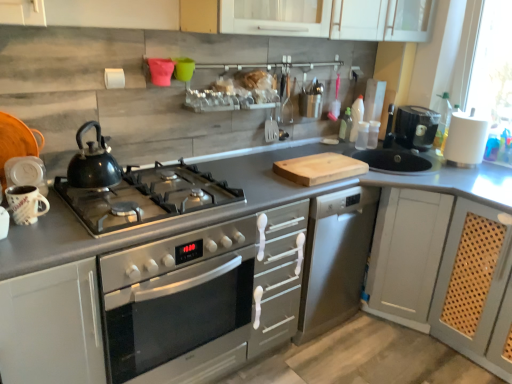
What do you see at coordinates (52, 326) in the screenshot? I see `white matte cabinet at lower left, which is the 1th cabinetry from left to right` at bounding box center [52, 326].

What is the approximate height of transparent plastic bottle at upper right?

The height of transparent plastic bottle at upper right is 8.45 inches.

What do you see at coordinates (26, 204) in the screenshot?
I see `matte ceramic mug at left, the 1th appliance from the left` at bounding box center [26, 204].

What is the approximate width of matte gray cabinet at right, the 1th cabinetry in the right-to-left sequence?

26.58 inches.

Measure the distance between point (319, 158) and camera.

A distance of 6.94 feet exists between point (319, 158) and camera.

What are the coordinates of `shiny black kettle at left` in the screenshot? It's located at (93, 163).

From the image's perspective, which is below, white matte paper towel holder at upper right, arranged as the 2th appliance when ordered from the bottom, or transparent plastic bottle at upper right?

white matte paper towel holder at upper right, arranged as the 2th appliance when ordered from the bottom, is shown below in the image.

Considering the relative sizes of white matte paper towel holder at upper right, the 2th appliance when ordered from left to right, and transparent plastic bottle at upper right in the image provided, is white matte paper towel holder at upper right, the 2th appliance when ordered from left to right, smaller than transparent plastic bottle at upper right?

Incorrect, white matte paper towel holder at upper right, the 2th appliance when ordered from left to right, is not smaller in size than transparent plastic bottle at upper right.

Are white matte paper towel holder at upper right, the 2th appliance when ordered from left to right, and transparent plastic bottle at upper right beside each other?

white matte paper towel holder at upper right, the 2th appliance when ordered from left to right, and transparent plastic bottle at upper right are clearly separated.

Choose the correct answer: Is white matte paper towel holder at upper right, the 2th appliance when ordered from left to right, inside transparent plastic bottle at upper right or outside it?

white matte paper towel holder at upper right, the 2th appliance when ordered from left to right, is not enclosed by transparent plastic bottle at upper right.

Is wooden cutting board at center turned away from matte ceramic mug at left, which is the 2th appliance from right to left?

wooden cutting board at center does not have its back to matte ceramic mug at left, which is the 2th appliance from right to left.

Is the depth of wooden cutting board at center greater than that of matte ceramic mug at left, which is the 2th appliance from right to left?

Yes, wooden cutting board at center is further from the camera.

In order to click on appliance located in front of the wooden cutting board at center in this screenshot , I will do coord(26,204).

Between shiny black kettle at left and black plastic coffee machine at right, which one appears on the right side from the viewer's perspective?

black plastic coffee machine at right.

Is point (76, 164) farther from camera compared to point (425, 115)?

No, it is in front of (425, 115).

From a real-world perspective, is shiny black kettle at left positioned under black plastic coffee machine at right based on gravity?

No.

The height and width of the screenshot is (384, 512). I want to click on coffee machine located on the right of matte gray cabinet at right, the 1th cabinetry in the right-to-left sequence, so coord(416,127).

From the image's perspective, is matte gray cabinet at right, arranged as the 2th cabinetry when viewed from the left, above black plastic coffee machine at right?

No, from the image's perspective, matte gray cabinet at right, arranged as the 2th cabinetry when viewed from the left, is not over black plastic coffee machine at right.

Which object is closer to the camera taking this photo, matte gray cabinet at right, arranged as the 2th cabinetry when viewed from the left, or black plastic coffee machine at right?

matte gray cabinet at right, arranged as the 2th cabinetry when viewed from the left, is in front.

Is shiny black kettle at left completely or partially outside of wooden cutting board at center?

Yes, shiny black kettle at left is outside of wooden cutting board at center.

Locate an element on the screen. kitchen appliance in front of the wooden cutting board at center is located at coordinates click(x=93, y=163).

From a real-world perspective, which is physically above, shiny black kettle at left or wooden cutting board at center?

shiny black kettle at left is physically above.

Is shiny black kettle at left positioned far away from wooden cutting board at center?

shiny black kettle at left is near wooden cutting board at center, not far away.

From the image's perspective, who appears lower, matte ceramic mug at left, which is the 1th appliance in bottom-to-top order, or shiny black kettle at left?

From the image's view, matte ceramic mug at left, which is the 1th appliance in bottom-to-top order, is below.

From a real-world perspective, relative to shiny black kettle at left, is matte ceramic mug at left, the 1th appliance from the left, vertically above or below?

From a real-world perspective, matte ceramic mug at left, the 1th appliance from the left, is physically below shiny black kettle at left.

Is matte ceramic mug at left, which is the 2th appliance from right to left, closer to the viewer compared to shiny black kettle at left?

Yes, it is in front of shiny black kettle at left.

Is matte ceramic mug at left, marked as the 2th appliance in a back-to-front arrangement, not near shiny black kettle at left?

No, matte ceramic mug at left, marked as the 2th appliance in a back-to-front arrangement, is in close proximity to shiny black kettle at left.

Which is further, (30, 191) or (392, 312)?

Point (392, 312)

Looking at the image, does matte ceramic mug at left, which is counted as the first appliance, starting from the front, seem bigger or smaller compared to matte gray cabinet at right, arranged as the 2th cabinetry when viewed from the left?

In the image, matte ceramic mug at left, which is counted as the first appliance, starting from the front, appears to be smaller than matte gray cabinet at right, arranged as the 2th cabinetry when viewed from the left.

Are matte ceramic mug at left, which is counted as the first appliance, starting from the front, and matte gray cabinet at right, arranged as the 2th cabinetry when viewed from the left, making contact?

matte ceramic mug at left, which is counted as the first appliance, starting from the front, and matte gray cabinet at right, arranged as the 2th cabinetry when viewed from the left, are not in contact.

In the image, is matte ceramic mug at left, which is the 1th appliance in bottom-to-top order, on the left side or the right side of matte gray cabinet at right, the 1th cabinetry in the right-to-left sequence?

matte ceramic mug at left, which is the 1th appliance in bottom-to-top order, is positioned on matte gray cabinet at right, the 1th cabinetry in the right-to-left sequence,'s left side.

Find the location of a particular element. The width and height of the screenshot is (512, 384). appliance above the transparent plastic bottle at upper right (from a real-world perspective) is located at coordinates (466, 140).

Identify the location of appliance in front of the wooden cutting board at center. (26, 204).

From the image, which object appears to be nearer to black plastic coffee machine at right, white matte cabinet at lower left, which is the 1th cabinetry from left to right, or wooden cutting board at center?

Based on the image, wooden cutting board at center appears to be nearer to black plastic coffee machine at right.

Estimate the real-world distances between objects in this image. Which object is closer to matte gray cabinet at right, the 1th cabinetry in the right-to-left sequence, matte ceramic mug at left, which is the 2th appliance from right to left, or white matte cabinet at lower left, placed as the second cabinetry when sorted from right to left?

The object closer to matte gray cabinet at right, the 1th cabinetry in the right-to-left sequence, is white matte cabinet at lower left, placed as the second cabinetry when sorted from right to left.

When comparing their distances from black plastic coffee machine at right, does wooden cutting board at center or transparent plastic bottle at upper right seem closer?

The object closer to black plastic coffee machine at right is transparent plastic bottle at upper right.

Which object lies further to the anchor point wooden cutting board at center, black plastic coffee machine at right or white matte paper towel holder at upper right, arranged as the 2th appliance when ordered from the bottom?

black plastic coffee machine at right is positioned further to the anchor wooden cutting board at center.

Considering their positions, is stainless steel oven at center positioned closer to matte ceramic mug at left, which is the 1th appliance in bottom-to-top order, than shiny black kettle at left?

Based on the image, shiny black kettle at left appears to be nearer to matte ceramic mug at left, which is the 1th appliance in bottom-to-top order.

Based on their spatial positions, is matte ceramic mug at left, which is counted as the first appliance, starting from the front, or shiny black kettle at left further from wooden cutting board at center?

Based on the image, matte ceramic mug at left, which is counted as the first appliance, starting from the front, appears to be further to wooden cutting board at center.

When comparing their distances from transparent plastic bottle at upper right, does matte ceramic mug at left, the 1th appliance from the left, or black plastic coffee machine at right seem closer?

black plastic coffee machine at right.

Based on their spatial positions, is matte ceramic mug at left, arranged as the 2th appliance when viewed from the top, or matte gray cabinet at right, the 1th cabinetry in the right-to-left sequence, closer to white matte paper towel holder at upper right, which is counted as the 1th appliance, starting from the top?

Based on the image, matte gray cabinet at right, the 1th cabinetry in the right-to-left sequence, appears to be nearer to white matte paper towel holder at upper right, which is counted as the 1th appliance, starting from the top.

The height and width of the screenshot is (384, 512). Find the location of `oven situated between shiny black kettle at left and wooden cutting board at center from left to right`. oven situated between shiny black kettle at left and wooden cutting board at center from left to right is located at coordinates (176, 296).

Locate an element on the screen. cabinetry between shiny black kettle at left and white matte paper towel holder at upper right, arranged as the 2th appliance when ordered from the bottom, in the horizontal direction is located at coordinates (443, 271).

You are a GUI agent. You are given a task and a screenshot of the screen. Output one action in this format:
    pyautogui.click(x=<x>, y=<y>)
    Task: Click on the cutting board located between white matte cabinet at lower left, which is the 1th cabinetry from left to right, and white matte paper towel holder at upper right, positioned as the 2th appliance in front-to-back order, in the left-right direction
    The width and height of the screenshot is (512, 384).
    Given the screenshot: What is the action you would take?
    pyautogui.click(x=319, y=168)

Where is `oven situated between white matte cabinet at lower left, placed as the second cabinetry when sorted from right to left, and wooden cutting board at center from left to right`? Image resolution: width=512 pixels, height=384 pixels. oven situated between white matte cabinet at lower left, placed as the second cabinetry when sorted from right to left, and wooden cutting board at center from left to right is located at coordinates (176, 296).